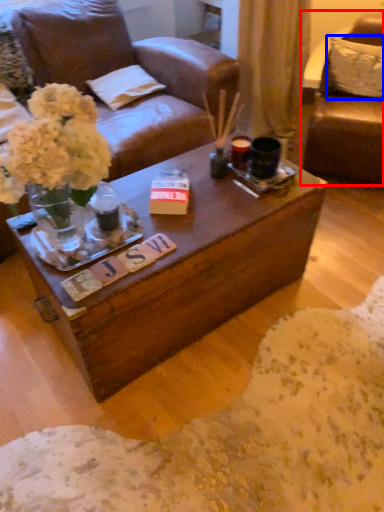
Question: Among these objects, which one is farthest to the camera, chair (highlighted by a red box) or pillow (highlighted by a blue box)?

Choices:
 (A) chair
 (B) pillow

Answer: (B)